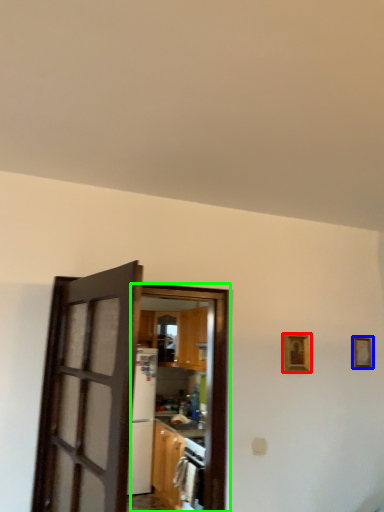
Question: Which object is positioned closest to picture frame (highlighted by a red box)? Select from picture frame (highlighted by a blue box) and door (highlighted by a green box).

Choices:
 (A) picture frame
 (B) door

Answer: (A)